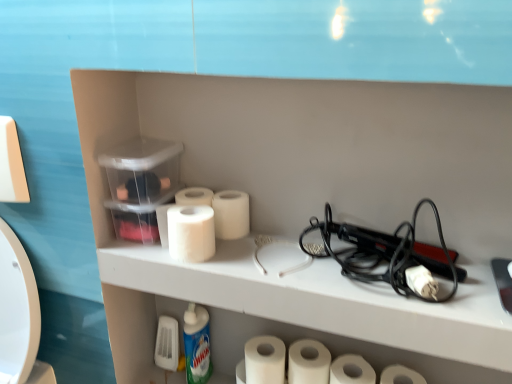
Question: Considering their positions, is white matte toilet paper at center, marked as the 2th toilet paper in a left-to-right arrangement, located in front of or behind black plastic hair straightener at right?

Choices:
 (A) front
 (B) behind

Answer: (B)

Question: Is point (223, 190) positioned closer to the camera than point (365, 276)?

Choices:
 (A) farther
 (B) closer

Answer: (A)

Question: Which object is positioned closest to the white matte toilet paper at center, marked as the 2th toilet paper in a left-to-right arrangement?

Choices:
 (A) white matte hairdryer at upper center
 (B) white glossy bottle at lower center
 (C) white matte toilet paper at center, which ranks as the 1th toilet paper in left-to-right order
 (D) white matte toilet paper at center, which appears as the 3th toilet paper when viewed from the left
 (E) white matte toilet paper at lower center, which is the 3th toilet paper from right to left

Answer: (C)

Question: Which object is positioned closest to the white matte hairdryer at upper center?

Choices:
 (A) white glossy bottle at lower center
 (B) white matte toilet paper at center, which ranks as the 1th toilet paper in left-to-right order
 (C) white matte toilet paper at center, positioned as the 4th toilet paper in right-to-left order
 (D) white matte paper towel at center
 (E) white matte toilet paper at center, marked as the 2th toilet paper in a left-to-right arrangement

Answer: (B)